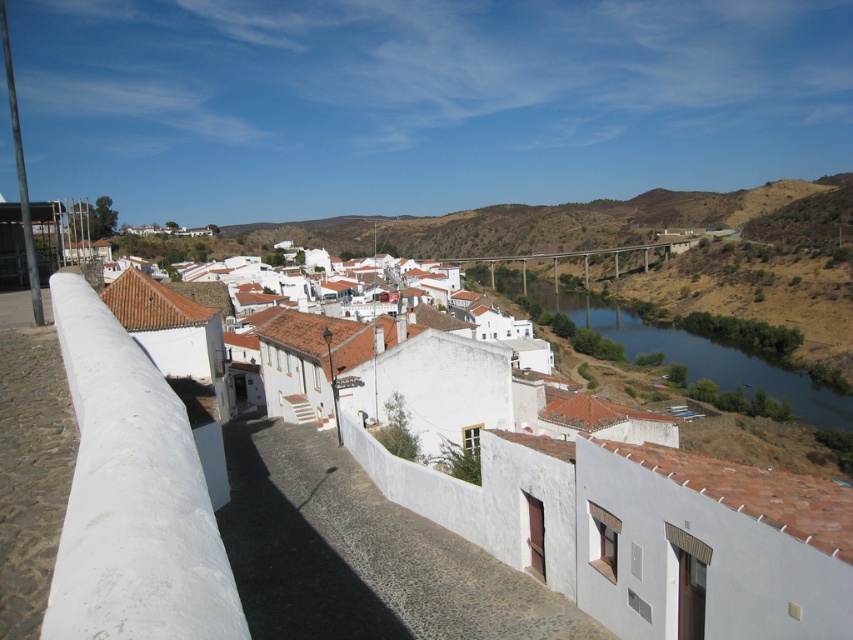
You are a tourist standing on the cobblestone street in the village. You see the blue smooth water at center and the matte concrete bridge at center. Which object appears larger in the scene?

The matte concrete bridge at center appears larger than the blue smooth water at center.

You are a tourist standing on the cobblestone street in the village. You see the blue smooth water at center and the matte concrete bridge at center. Which object is positioned higher from the ground level?

The matte concrete bridge at center is positioned higher than the blue smooth water at center since the water is located below the bridge.